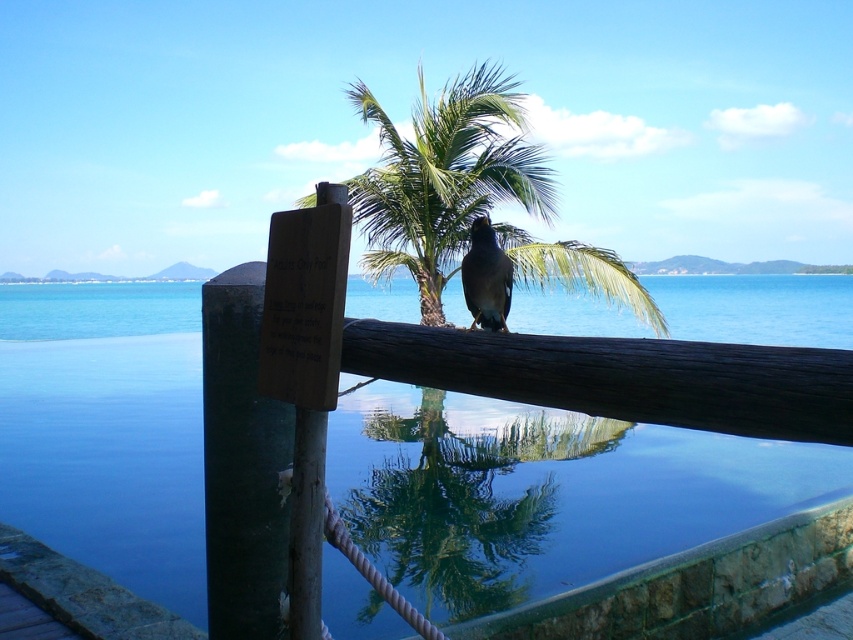
Which is more to the right, transparent glass water at center or shiny brown bird at center?

transparent glass water at center

Image resolution: width=853 pixels, height=640 pixels. What do you see at coordinates (544, 492) in the screenshot?
I see `transparent glass water at center` at bounding box center [544, 492].

Locate an element on the screen. Image resolution: width=853 pixels, height=640 pixels. transparent glass water at center is located at coordinates (544, 492).